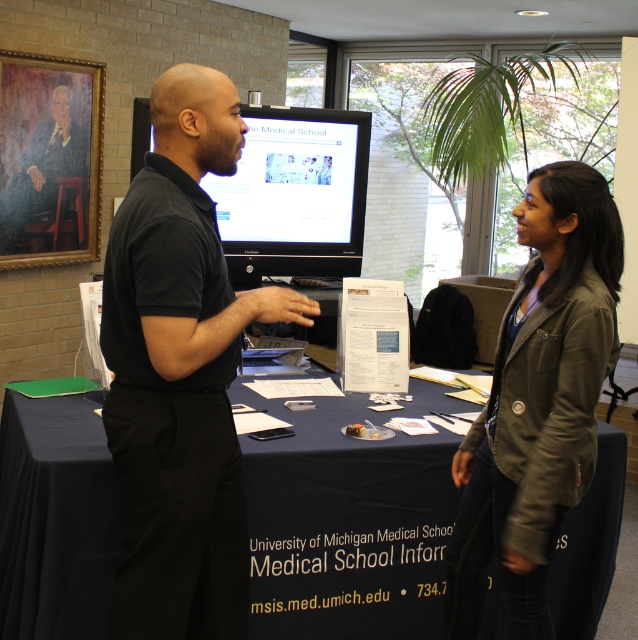
Question: Which point is farther to the camera?

Choices:
 (A) (558, 316)
 (B) (272, 148)
 (C) (152, 516)
 (D) (292, 467)

Answer: (B)

Question: Can you confirm if black fabric table at center is positioned above leather jacket at center?

Choices:
 (A) yes
 (B) no

Answer: (B)

Question: Is black fabric table at center bigger than black matte shirt at center?

Choices:
 (A) no
 (B) yes

Answer: (B)

Question: Can you confirm if black matte shirt at center is wider than leather jacket at center?

Choices:
 (A) no
 (B) yes

Answer: (B)

Question: Estimate the real-world distances between objects in this image. Which object is farther from the black matte shirt at center?

Choices:
 (A) matte black monitor at center
 (B) leather jacket at center
 (C) black fabric table at center

Answer: (A)

Question: Which object appears closest to the camera in this image?

Choices:
 (A) black fabric table at center
 (B) matte black monitor at center

Answer: (A)